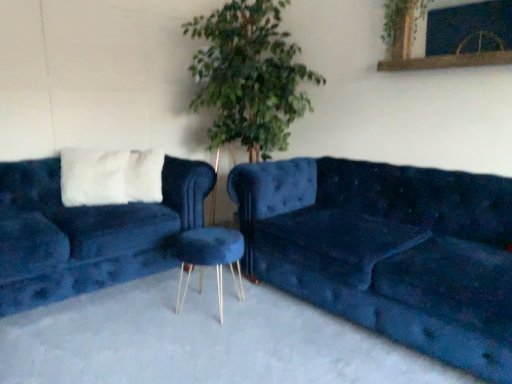
Describe the element at coordinates (388, 251) in the screenshot. I see `velvet blue couch at right, which is counted as the second studio couch, starting from the left` at that location.

Where is `velvet blue stool at center`? velvet blue stool at center is located at coordinates (210, 258).

Is green leafy plant at upper center positioned before velvet blue couch at left, acting as the second studio couch starting from the right?

No.

Could you tell me if green leafy plant at upper center is facing velvet blue couch at left, acting as the second studio couch starting from the right?

No, green leafy plant at upper center does not turn towards velvet blue couch at left, acting as the second studio couch starting from the right.

Considering the relative positions of green leafy plant at upper center and velvet blue couch at left, acting as the second studio couch starting from the right, in the image provided, is green leafy plant at upper center to the right of velvet blue couch at left, acting as the second studio couch starting from the right, from the viewer's perspective?

Yes, green leafy plant at upper center is to the right of velvet blue couch at left, acting as the second studio couch starting from the right.

From the image's perspective, which one is positioned lower, velvet blue couch at left, acting as the second studio couch starting from the right, or velvet blue couch at right, which is counted as the second studio couch, starting from the left?

velvet blue couch at right, which is counted as the second studio couch, starting from the left, from the image's perspective.

Is velvet blue couch at left, acting as the second studio couch starting from the right, oriented away from velvet blue couch at right, which appears as the first studio couch when viewed from the right?

No, velvet blue couch at left, acting as the second studio couch starting from the right, is not facing the opposite direction of velvet blue couch at right, which appears as the first studio couch when viewed from the right.

Considering the positions of objects velvet blue couch at left, arranged as the 1th studio couch when viewed from the left, and velvet blue couch at right, which appears as the first studio couch when viewed from the right, in the image provided, who is in front, velvet blue couch at left, arranged as the 1th studio couch when viewed from the left, or velvet blue couch at right, which appears as the first studio couch when viewed from the right,?

Positioned in front is velvet blue couch at right, which appears as the first studio couch when viewed from the right.

Is velvet blue couch at right, which appears as the first studio couch when viewed from the right, with green leafy plant at upper center?

No, velvet blue couch at right, which appears as the first studio couch when viewed from the right, is not in contact with green leafy plant at upper center.

Locate an element on the screen. the 2nd studio couch in front of the green leafy plant at upper center is located at coordinates (388, 251).

Is velvet blue couch at right, which is counted as the second studio couch, starting from the left, shorter than green leafy plant at upper center?

No, velvet blue couch at right, which is counted as the second studio couch, starting from the left, is not shorter than green leafy plant at upper center.

Is the position of velvet blue couch at right, which is counted as the second studio couch, starting from the left, more distant than that of green leafy plant at upper center?

No, it is not.

Can you confirm if green leafy plant at upper center is positioned to the right of velvet blue stool at center?

Yes.

Looking at this image, considering the relative positions of green leafy plant at upper center and velvet blue stool at center in the image provided, is green leafy plant at upper center in front of velvet blue stool at center?

No, it is behind velvet blue stool at center.

Considering the sizes of objects green leafy plant at upper center and velvet blue stool at center in the image provided, who is bigger, green leafy plant at upper center or velvet blue stool at center?

With larger size is velvet blue stool at center.

Can you confirm if green leafy plant at upper center is thinner than velvet blue stool at center?

Correct, the width of green leafy plant at upper center is less than that of velvet blue stool at center.

From the image's perspective, is velvet blue couch at right, which appears as the first studio couch when viewed from the right, on velvet blue couch at left, acting as the second studio couch starting from the right?

No, from the image's perspective, velvet blue couch at right, which appears as the first studio couch when viewed from the right, is not over velvet blue couch at left, acting as the second studio couch starting from the right.

In the image, there is a velvet blue couch at right, which appears as the first studio couch when viewed from the right. Where is `studio couch above it (from the image's perspective)`? Image resolution: width=512 pixels, height=384 pixels. studio couch above it (from the image's perspective) is located at coordinates coord(88,232).

Considering the sizes of objects velvet blue couch at right, which appears as the first studio couch when viewed from the right, and velvet blue couch at left, arranged as the 1th studio couch when viewed from the left, in the image provided, who is thinner, velvet blue couch at right, which appears as the first studio couch when viewed from the right, or velvet blue couch at left, arranged as the 1th studio couch when viewed from the left,?

velvet blue couch at left, arranged as the 1th studio couch when viewed from the left.

Are velvet blue couch at right, which is counted as the second studio couch, starting from the left, and velvet blue couch at left, arranged as the 1th studio couch when viewed from the left, making contact?

No, velvet blue couch at right, which is counted as the second studio couch, starting from the left, is not with velvet blue couch at left, arranged as the 1th studio couch when viewed from the left.

From the image's perspective, is velvet blue couch at left, acting as the second studio couch starting from the right, located beneath velvet blue stool at center?

No, from the image's perspective, velvet blue couch at left, acting as the second studio couch starting from the right, is not below velvet blue stool at center.

From a real-world perspective, does velvet blue couch at left, arranged as the 1th studio couch when viewed from the left, stand above velvet blue stool at center?

Indeed, from a real-world perspective, velvet blue couch at left, arranged as the 1th studio couch when viewed from the left, stands above velvet blue stool at center.

In the scene shown: Do you think velvet blue couch at left, acting as the second studio couch starting from the right, is within velvet blue stool at center, or outside of it?

velvet blue couch at left, acting as the second studio couch starting from the right, cannot be found inside velvet blue stool at center.

The width and height of the screenshot is (512, 384). I want to click on the 1st studio couch in front of the velvet blue stool at center, so click(88, 232).

From a real-world perspective, relative to velvet blue stool at center, is velvet blue couch at right, which is counted as the second studio couch, starting from the left, vertically above or below?

Clearly, from a real-world perspective, velvet blue couch at right, which is counted as the second studio couch, starting from the left, is above velvet blue stool at center.

Is velvet blue couch at right, which is counted as the second studio couch, starting from the left, placed right next to velvet blue stool at center?

No, velvet blue couch at right, which is counted as the second studio couch, starting from the left, is not making contact with velvet blue stool at center.

Is velvet blue couch at right, which is counted as the second studio couch, starting from the left, taller than velvet blue stool at center?

Indeed, velvet blue couch at right, which is counted as the second studio couch, starting from the left, has a greater height compared to velvet blue stool at center.

Where is `the 2nd studio couch counting from the left of the green leafy plant at upper center`? The image size is (512, 384). the 2nd studio couch counting from the left of the green leafy plant at upper center is located at coordinates (88, 232).

At what (x,y) coordinates should I click in order to perform the action: click on studio couch above the velvet blue couch at right, which is counted as the second studio couch, starting from the left (from a real-world perspective). Please return your answer as a coordinate pair (x, y). The width and height of the screenshot is (512, 384). Looking at the image, I should click on (x=88, y=232).

Considering their positions, is velvet blue couch at left, arranged as the 1th studio couch when viewed from the left, positioned closer to green leafy plant at upper center than velvet blue couch at right, which appears as the first studio couch when viewed from the right?

velvet blue couch at right, which appears as the first studio couch when viewed from the right, is positioned closer to the anchor green leafy plant at upper center.

When comparing their distances from velvet blue couch at right, which is counted as the second studio couch, starting from the left, does green leafy plant at upper center or velvet blue stool at center seem closer?

velvet blue stool at center is closer to velvet blue couch at right, which is counted as the second studio couch, starting from the left.

Looking at the image, which one is located closer to green leafy plant at upper center, velvet blue couch at left, acting as the second studio couch starting from the right, or velvet blue stool at center?

Among the two, velvet blue stool at center is located nearer to green leafy plant at upper center.

When comparing their distances from velvet blue couch at left, arranged as the 1th studio couch when viewed from the left, does green leafy plant at upper center or velvet blue stool at center seem closer?

Based on the image, velvet blue stool at center appears to be nearer to velvet blue couch at left, arranged as the 1th studio couch when viewed from the left.

Looking at the image, which one is located further to velvet blue couch at right, which appears as the first studio couch when viewed from the right, velvet blue stool at center or velvet blue couch at left, arranged as the 1th studio couch when viewed from the left?

velvet blue couch at left, arranged as the 1th studio couch when viewed from the left, is positioned further to the anchor velvet blue couch at right, which appears as the first studio couch when viewed from the right.

Considering their positions, is velvet blue couch at right, which appears as the first studio couch when viewed from the right, positioned further to velvet blue couch at left, acting as the second studio couch starting from the right, than velvet blue stool at center?

velvet blue couch at right, which appears as the first studio couch when viewed from the right, lies further to velvet blue couch at left, acting as the second studio couch starting from the right, than the other object.

When comparing their distances from velvet blue couch at right, which appears as the first studio couch when viewed from the right, does velvet blue couch at left, arranged as the 1th studio couch when viewed from the left, or green leafy plant at upper center seem further?

The object further to velvet blue couch at right, which appears as the first studio couch when viewed from the right, is green leafy plant at upper center.

Based on their spatial positions, is velvet blue stool at center or green leafy plant at upper center further from velvet blue couch at left, acting as the second studio couch starting from the right?

Among the two, green leafy plant at upper center is located further to velvet blue couch at left, acting as the second studio couch starting from the right.

Find the location of `bar stool situated between velvet blue couch at left, acting as the second studio couch starting from the right, and velvet blue couch at right, which is counted as the second studio couch, starting from the left, from left to right`. bar stool situated between velvet blue couch at left, acting as the second studio couch starting from the right, and velvet blue couch at right, which is counted as the second studio couch, starting from the left, from left to right is located at coordinates (210, 258).

This screenshot has width=512, height=384. What are the coordinates of `studio couch located between velvet blue couch at left, arranged as the 1th studio couch when viewed from the left, and green leafy plant at upper center in the left-right direction` in the screenshot? It's located at (388, 251).

At what (x,y) coordinates should I click in order to perform the action: click on bar stool between velvet blue couch at left, acting as the second studio couch starting from the right, and green leafy plant at upper center, in the horizontal direction. Please return your answer as a coordinate pair (x, y). Looking at the image, I should click on (210, 258).